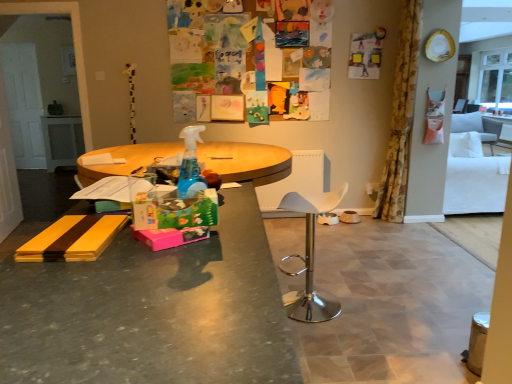
Find the location of a particular element. The image size is (512, 384). free spot behind brown ceramic bowl at center, the second bowl in the left-to-right sequence is located at coordinates (345, 216).